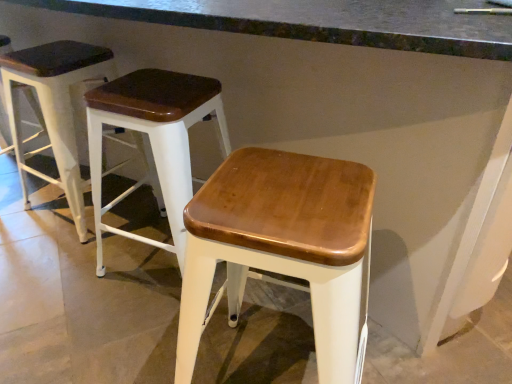
I want to click on free location above wooden seat at center, the 1th stool positioned from the right (from a real-world perspective), so click(x=290, y=191).